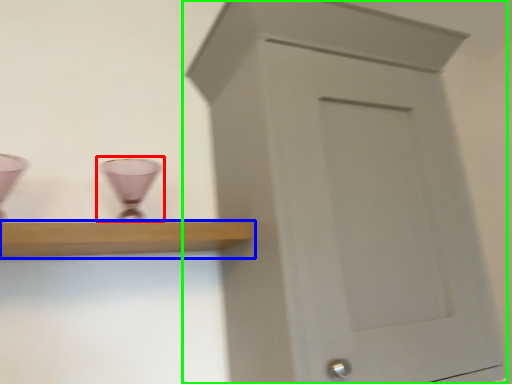
Question: Which is nearer to the candle holder (highlighted by a red box)? shelf (highlighted by a blue box) or cupboard (highlighted by a green box).

Choices:
 (A) shelf
 (B) cupboard

Answer: (A)